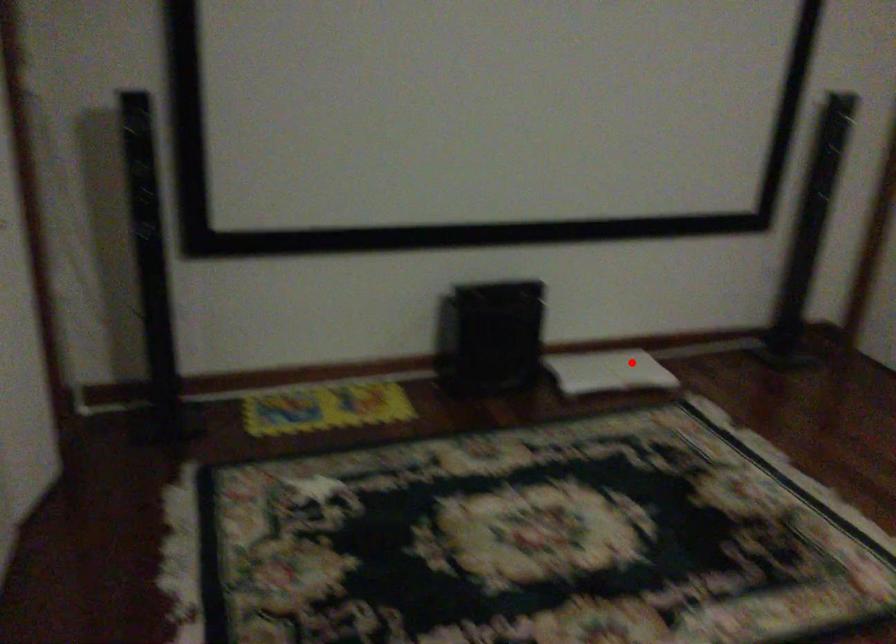
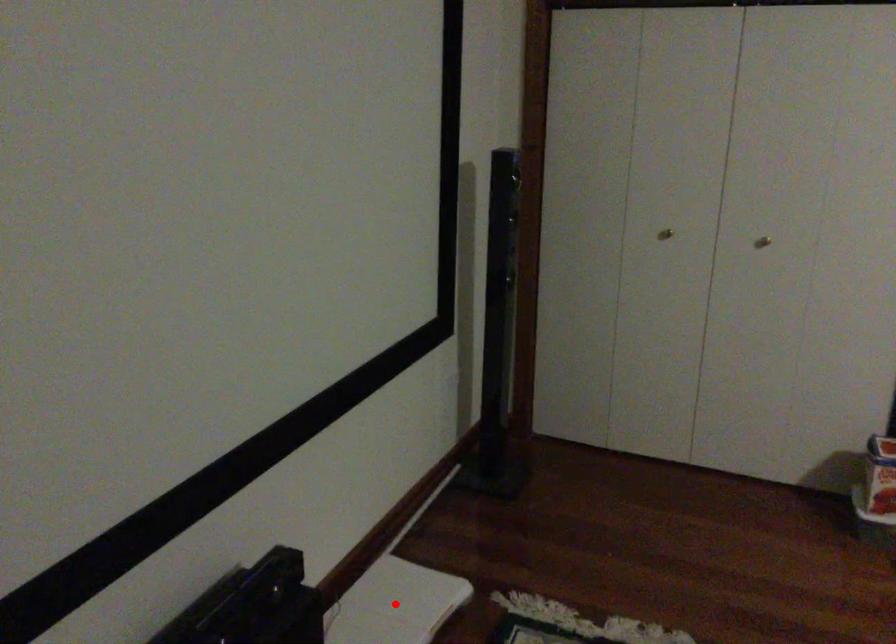
I am providing you with two images of the same scene from different viewpoints. A red point is marked on the first image and another point is marked on the second image. Does the point marked in image1 correspond to the same location as the one in image2?

Yes